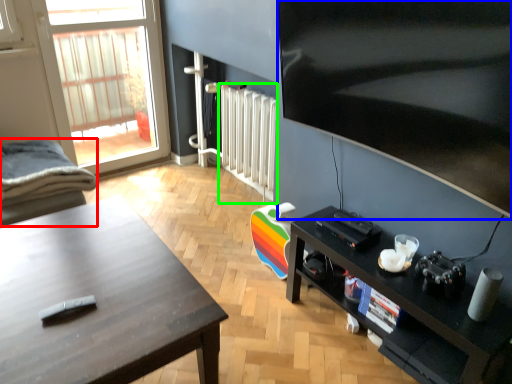
Question: Based on their relative distances, which object is farther from chair (highlighted by a red box)? Choose from television (highlighted by a blue box) and radiator (highlighted by a green box).

Choices:
 (A) television
 (B) radiator

Answer: (A)